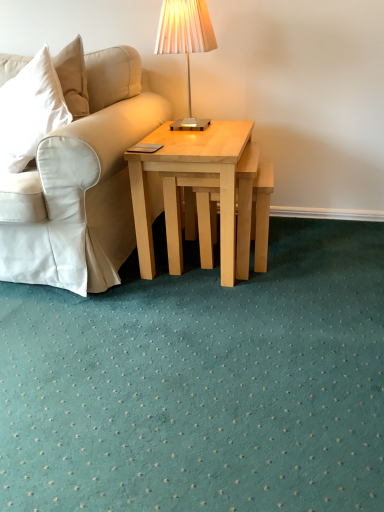
What are the coordinates of `vacant area that lies to the right of light wood stool at center` in the screenshot? It's located at (309, 258).